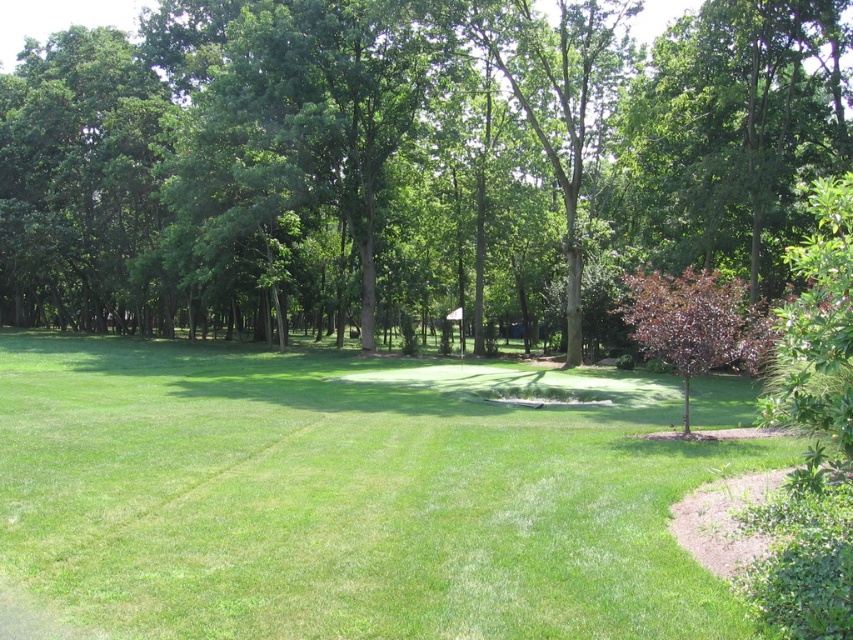
Question: Does green leafy tree at center have a smaller size compared to green grass at center?

Choices:
 (A) yes
 (B) no

Answer: (B)

Question: Does green grass at center come in front of purple glossy tree at right?

Choices:
 (A) no
 (B) yes

Answer: (B)

Question: Is green grass at center in front of purple glossy tree at right?

Choices:
 (A) no
 (B) yes

Answer: (B)

Question: Which of the following is the farthest from the observer?

Choices:
 (A) purple glossy tree at right
 (B) green leafy tree at center
 (C) green grass at center

Answer: (B)

Question: Which object appears closest to the camera in this image?

Choices:
 (A) green leafy tree at center
 (B) purple glossy tree at right
 (C) green grass at center

Answer: (C)

Question: Among these objects, which one is nearest to the camera?

Choices:
 (A) green grass at center
 (B) purple glossy tree at right
 (C) green leafy tree at center

Answer: (A)